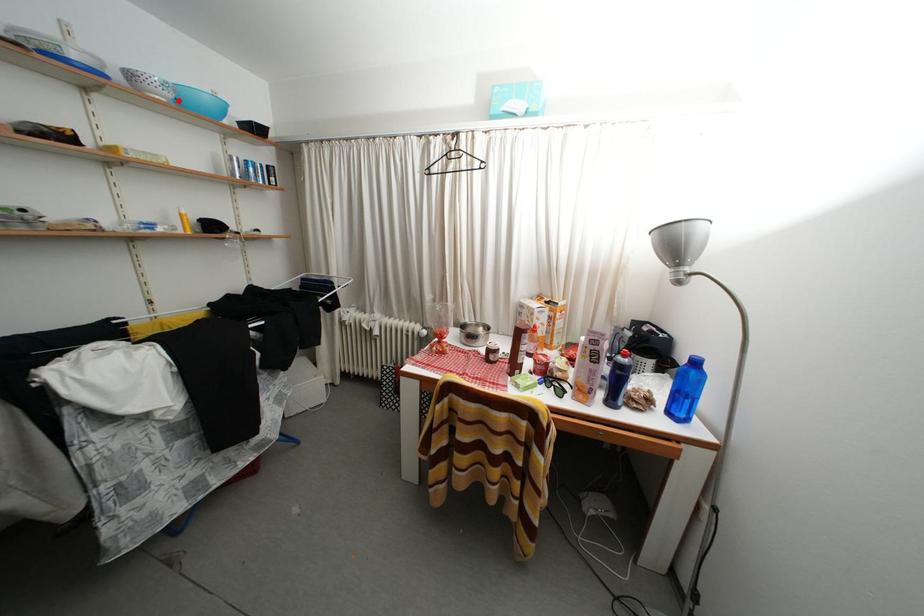
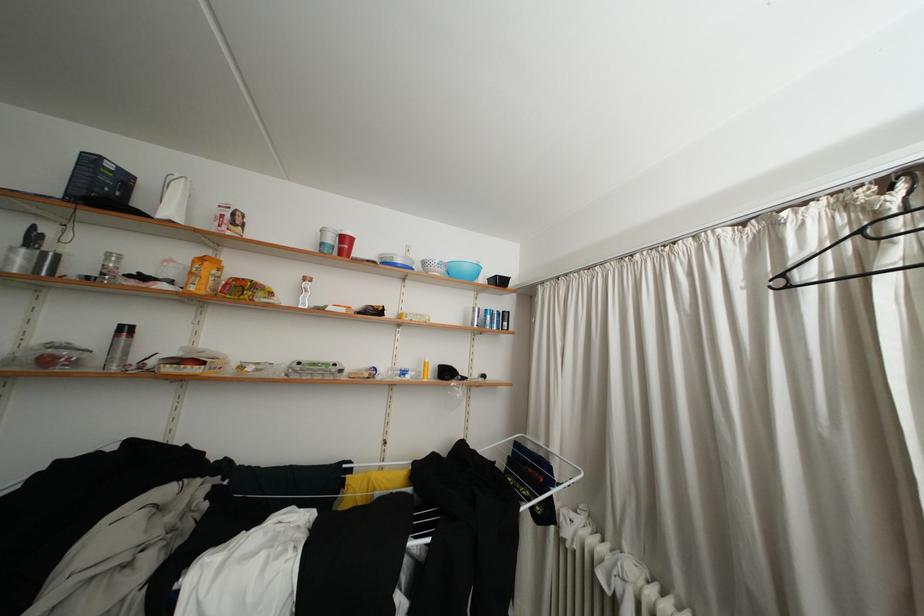
Where in the second image is the point corresponding to the highlighted location from the first image?

(451, 276)